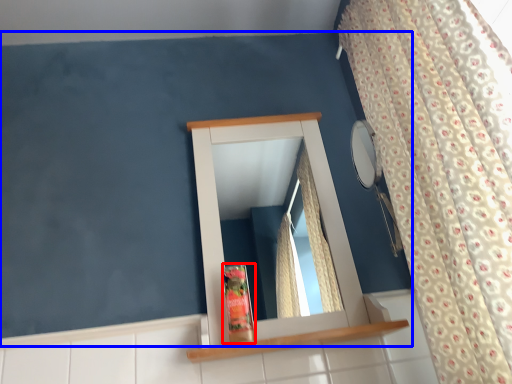
Question: Among these objects, which one is nearest to the camera, toiletry (highlighted by a red box) or backdrop (highlighted by a blue box)?

Choices:
 (A) toiletry
 (B) backdrop

Answer: (B)